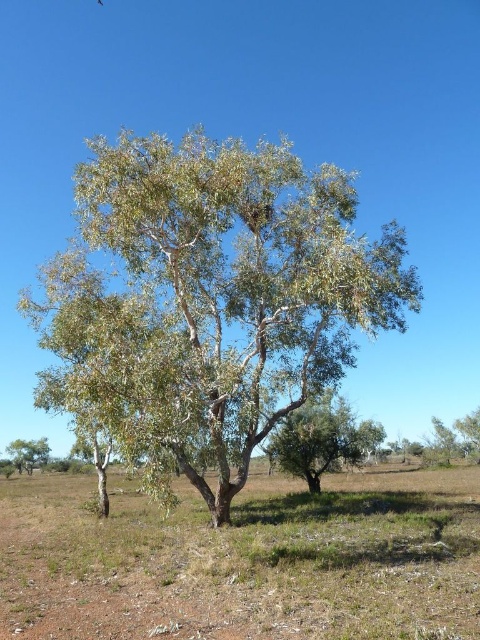
You are a botanist studying the tree and the soil in the image. Which of the two, the white papery bark tree at center or the brown soil at center, has a smaller width?

The white papery bark tree at center is thinner than the brown soil at center, so the white papery bark tree at center has a smaller width.

You are standing at the edge of an arid landscape and see the green leafy tree at center and the green leafy tree at lower left. Which tree is positioned to the right of the other?

The green leafy tree at center is positioned to the right of the green leafy tree at lower left.

You are a hiker trying to locate a specific tree in the arid landscape. You have a map that marks the white papery bark tree at center and the green leafy tree at lower left. According to the map, which tree is positioned more to the east?

The white papery bark tree at center is to the right of the green leafy tree at lower left. Since the green leafy tree at lower left is on the left side, it would be positioned more to the east compared to the white papery bark tree at center.